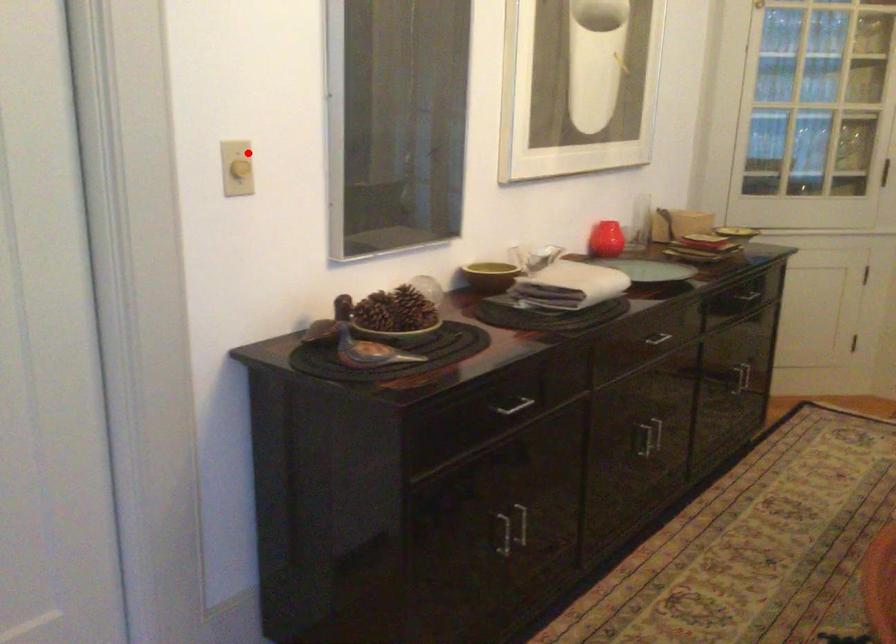
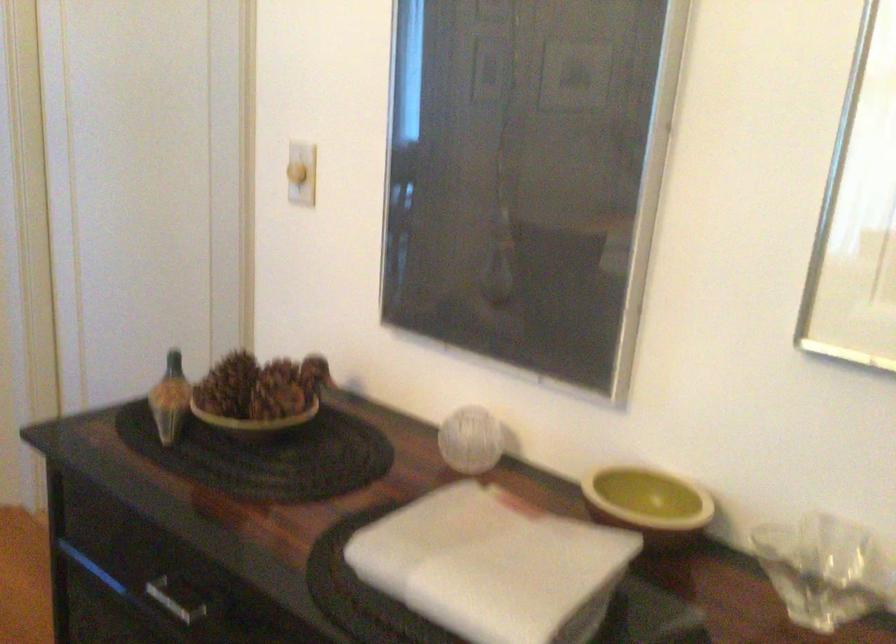
Question: A red point is marked in image1. In image2, is the corresponding 3D point closer to the camera or farther? Reply with the corresponding letter.

Choices:
 (A) The corresponding 3D point is closer.
 (B) The corresponding 3D point is farther.

Answer: (A)